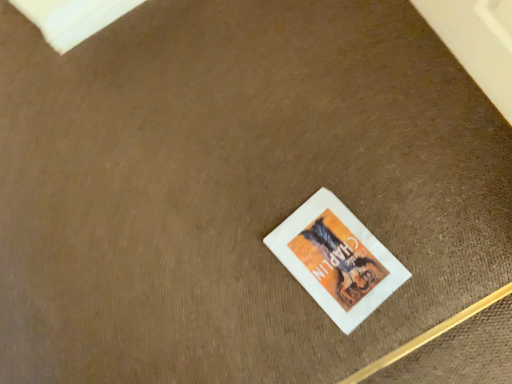
Where is `vacant point to the left of white paper book at center`? vacant point to the left of white paper book at center is located at coordinates (266, 308).